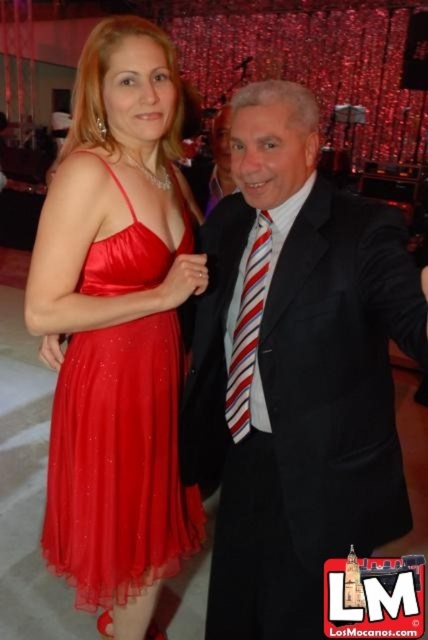
You are a photographer setting up a camera for a formal event. You need to ensure both the black satin suit at center and the satin dress at left are clearly visible in the frame. Considering their sizes, which one should you focus on first to ensure proper exposure?

The black satin suit at center has a larger size compared to the satin dress at left, so you should focus on the black satin suit at center first to ensure proper exposure since it occupies more space in the frame.